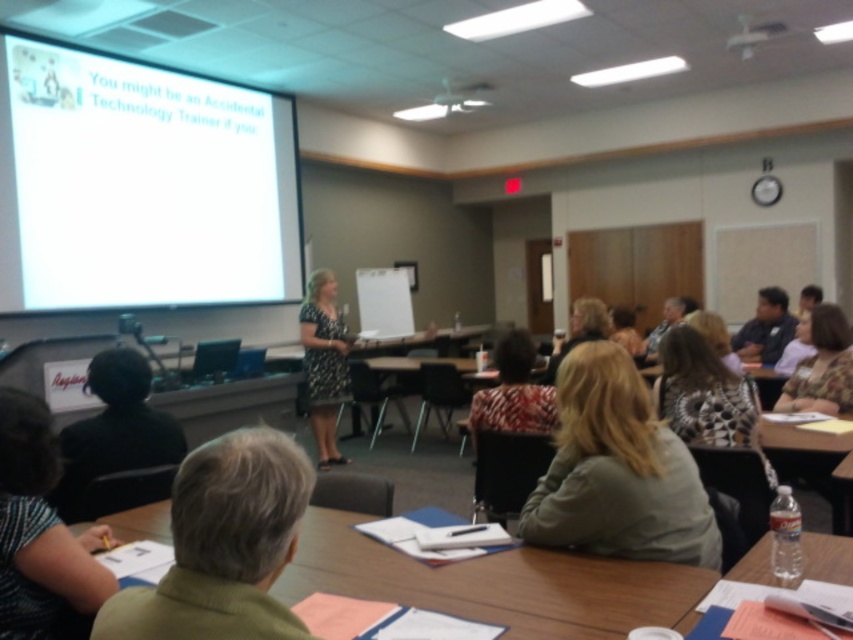
Between black dotted dress at center and blonde hair at center, which one has more height?

black dotted dress at center

In the scene shown: Can you confirm if black dotted dress at center is wider than blonde hair at center?

No.

Which is behind, point (323, 436) or point (576, 314)?

Point (323, 436)

This screenshot has height=640, width=853. Identify the location of black dotted dress at center. tap(323, 362).

Between point (13, 72) and point (329, 275), which one is positioned behind?

The point (329, 275) is behind.

Between white matte projection screen at upper left and black dotted dress at center, which one is positioned lower?

black dotted dress at center is below.

Between point (19, 200) and point (323, 307), which one is positioned in front?

Positioned in front is point (19, 200).

Locate an element on the screen. The image size is (853, 640). white matte projection screen at upper left is located at coordinates (142, 184).

Can you confirm if patterned fabric blouse at lower right is positioned above clear plastic bottle at lower right?

Yes, patterned fabric blouse at lower right is above clear plastic bottle at lower right.

At what (x,y) coordinates should I click in order to perform the action: click on patterned fabric blouse at lower right. Please return your answer as a coordinate pair (x, y). The image size is (853, 640). Looking at the image, I should click on (822, 368).

Locate an element on the screen. The width and height of the screenshot is (853, 640). patterned fabric blouse at lower right is located at coordinates (822, 368).